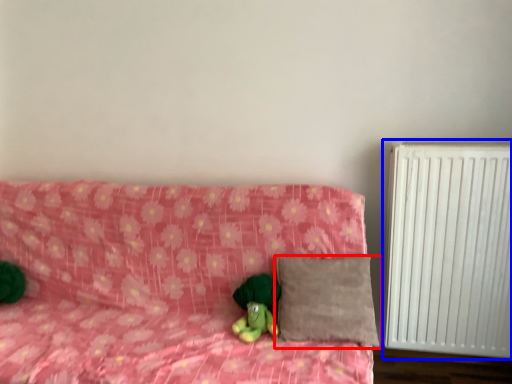
Question: Which object appears farthest to the camera in this image, pillow (highlighted by a red box) or radiator (highlighted by a blue box)?

Choices:
 (A) pillow
 (B) radiator

Answer: (B)